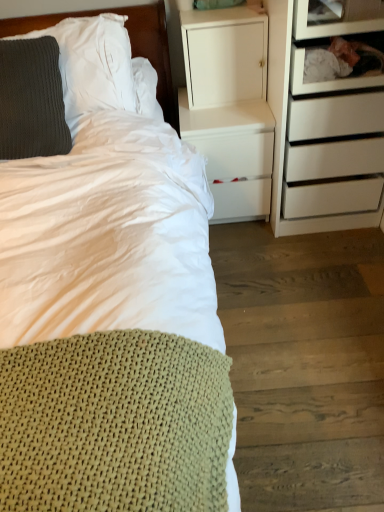
You are a GUI agent. You are given a task and a screenshot of the screen. Output one action in this format:
    pyautogui.click(x=<x>, y=<y>)
    Task: Click on the vacant area on top of white matte nightstand at center (from a real-world perspective)
    
    Given the screenshot: What is the action you would take?
    pyautogui.click(x=219, y=109)